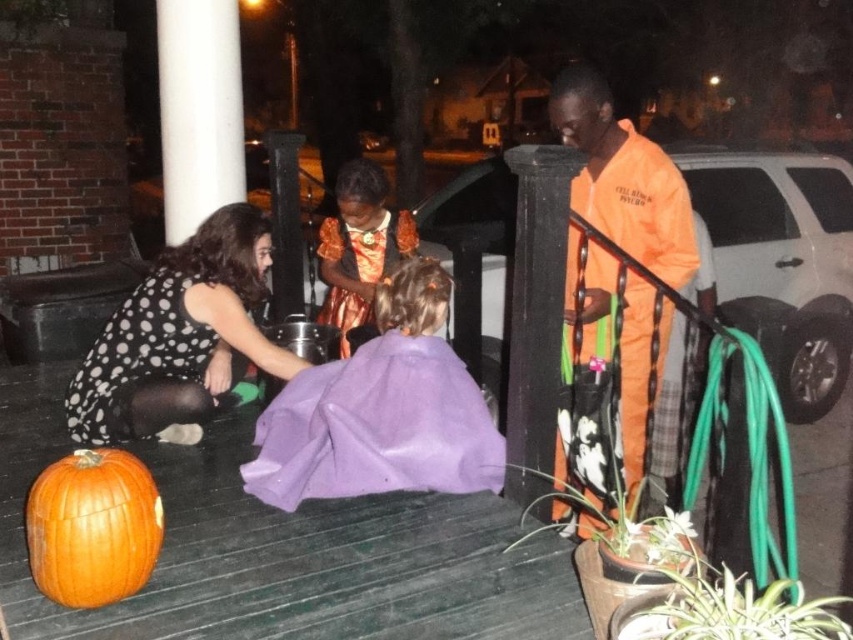
Who is taller, orange jumpsuit at right or orange satin dress at center?

orange jumpsuit at right

Can you confirm if orange jumpsuit at right is positioned to the left of orange satin dress at center?

Incorrect, orange jumpsuit at right is not on the left side of orange satin dress at center.

What are the coordinates of `orange jumpsuit at right` in the screenshot? It's located at (624, 179).

Who is higher up, purple satin dress at center or orange satin dress at center?

Positioned higher is orange satin dress at center.

Based on the photo, can you confirm if purple satin dress at center is positioned above orange satin dress at center?

Actually, purple satin dress at center is below orange satin dress at center.

This screenshot has height=640, width=853. Describe the element at coordinates (376, 428) in the screenshot. I see `purple satin dress at center` at that location.

Find the location of a particular element. purple satin dress at center is located at coordinates (376, 428).

Is black dotted dress at lower left taller than orange jumpsuit at right?

No.

What do you see at coordinates (178, 333) in the screenshot?
I see `black dotted dress at lower left` at bounding box center [178, 333].

Identify the location of black dotted dress at lower left. (178, 333).